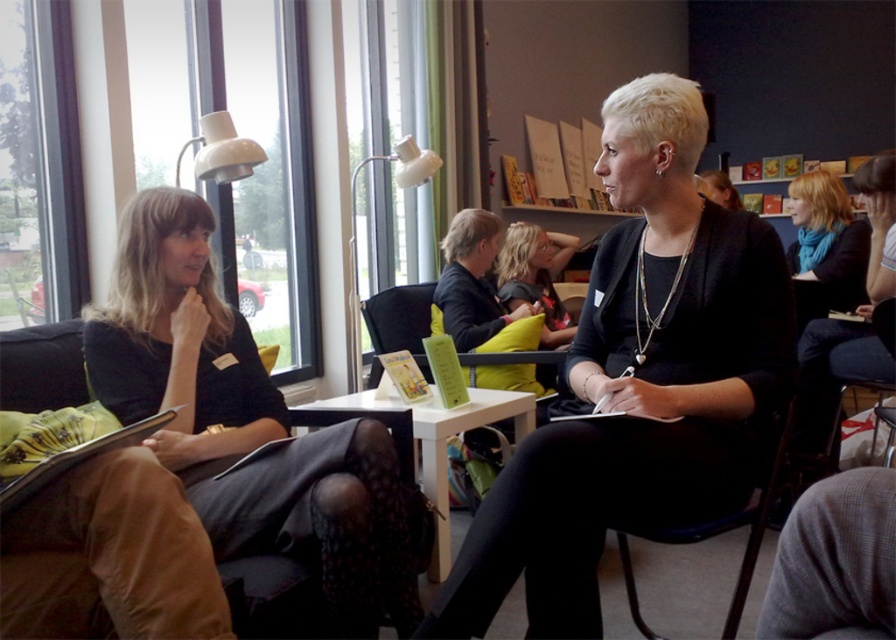
Can you confirm if matte black jacket at center is positioned above white glossy table at center?

Yes.

Does matte black jacket at center have a greater height compared to white glossy table at center?

Indeed, matte black jacket at center has a greater height compared to white glossy table at center.

Find the location of a particular element. The height and width of the screenshot is (640, 896). matte black jacket at center is located at coordinates (639, 381).

Locate an element on the screen. The height and width of the screenshot is (640, 896). matte black jacket at center is located at coordinates (639, 381).

Who is positioned more to the right, matte black jacket at left or blonde hair at center?

From the viewer's perspective, blonde hair at center appears more on the right side.

Is matte black jacket at left wider than blonde hair at center?

Correct, the width of matte black jacket at left exceeds that of blonde hair at center.

Between point (343, 464) and point (546, 304), which one is positioned in front?

Point (343, 464) is in front.

This screenshot has width=896, height=640. I want to click on matte black jacket at left, so click(178, 340).

Does point (746, 212) come farther from viewer compared to point (735, 593)?

No, it is not.

Which of these two, matte black jacket at center or black plastic chair at center, stands shorter?

With less height is black plastic chair at center.

The width and height of the screenshot is (896, 640). Describe the element at coordinates (639, 381) in the screenshot. I see `matte black jacket at center` at that location.

The height and width of the screenshot is (640, 896). Find the location of `matte black jacket at center`. matte black jacket at center is located at coordinates (639, 381).